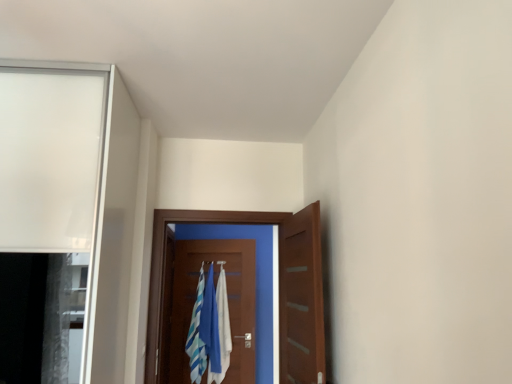
Question: Considering the positions of point (216, 301) and point (310, 297), is point (216, 301) closer or farther from the camera than point (310, 297)?

Choices:
 (A) farther
 (B) closer

Answer: (A)

Question: Considering their positions, is blue fabric laundry at center located in front of or behind wooden door at center, positioned as the 2th door in back-to-front order?

Choices:
 (A) front
 (B) behind

Answer: (B)

Question: Based on their relative distances, which object is nearer to the wooden door at center, which is counted as the 1th door, starting from the back?

Choices:
 (A) wooden door at center, positioned as the 2th door in back-to-front order
 (B) white cotton bath towel at center
 (C) blue fabric laundry at center
 (D) wooden door at center, the first door from the front

Answer: (C)

Question: Based on their relative distances, which object is nearer to the white cotton bath towel at center?

Choices:
 (A) wooden door at center, which is counted as the 1th door, starting from the back
 (B) wooden door at center, which ranks as the 2th door in front-to-back order
 (C) wooden door at center, the 3th door when ordered from back to front
 (D) blue fabric laundry at center

Answer: (D)